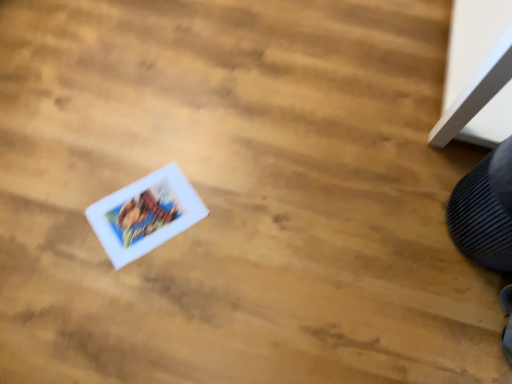
Identify the location of free spot to the right of white matte comic book at center. (228, 225).